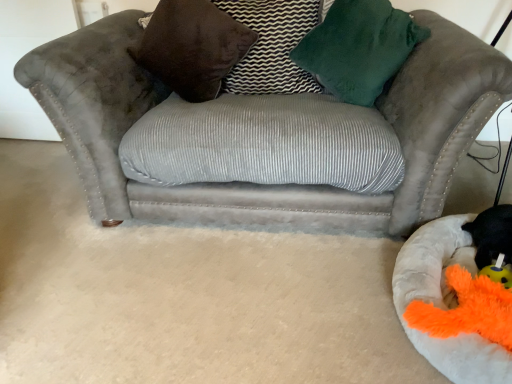
Identify the location of free location in front of suede gray couch at center. (214, 301).